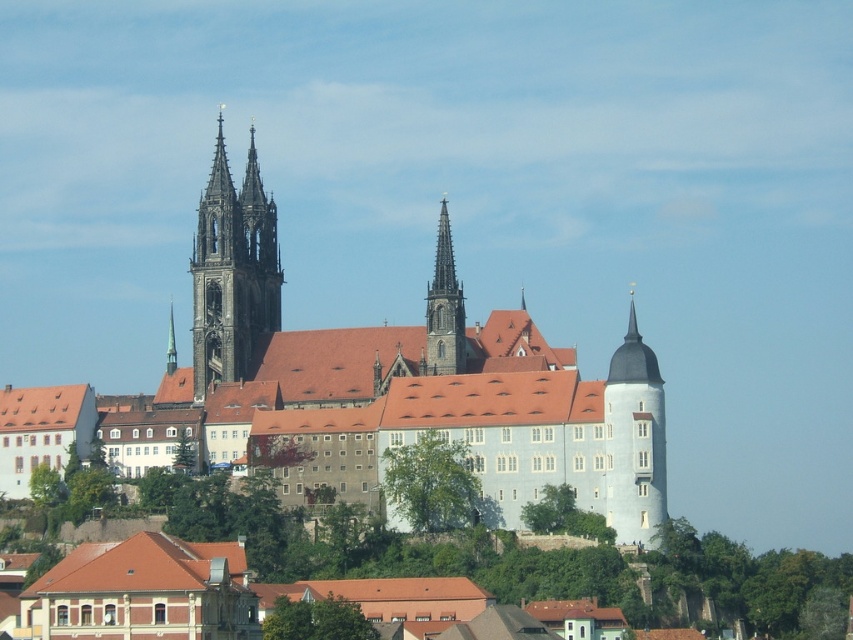
Question: Estimate the real-world distances between objects in this image. Which object is closer to the smooth gray stone spire at center?

Choices:
 (A) dark gray stone tower at upper left
 (B) smooth stone church at center
 (C) white stone tower at right

Answer: (B)

Question: Is smooth stone church at center closer to the viewer compared to dark gray stone tower at upper left?

Choices:
 (A) yes
 (B) no

Answer: (A)

Question: Can you confirm if smooth stone church at center is positioned to the right of dark gray stone tower at upper left?

Choices:
 (A) no
 (B) yes

Answer: (B)

Question: Which point is farther from the camera taking this photo?

Choices:
 (A) (230, 241)
 (B) (612, 476)
 (C) (515, 410)

Answer: (A)

Question: Considering the real-world distances, which object is closest to the white stone tower at right?

Choices:
 (A) dark gray stone tower at upper left
 (B) smooth gray stone spire at center
 (C) smooth stone church at center

Answer: (B)

Question: Can you confirm if smooth stone church at center is wider than dark gray stone tower at upper left?

Choices:
 (A) no
 (B) yes

Answer: (B)